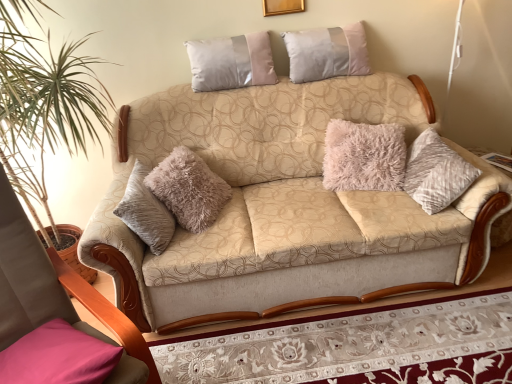
What is the approximate width of gold wooden picture frame at upper center?

gold wooden picture frame at upper center is 1.23 inches in width.

How much space does satin-like beige pillow at upper center, placed as the second pillow when sorted from front to back, occupy horizontally?

The width of satin-like beige pillow at upper center, placed as the second pillow when sorted from front to back, is 18.73 centimeters.

This screenshot has width=512, height=384. Describe the element at coordinates (56, 294) in the screenshot. I see `wooden armchair at left` at that location.

Identify the location of gold wooden picture frame at upper center. The width and height of the screenshot is (512, 384). (282, 7).

You are a GUI agent. You are given a task and a screenshot of the screen. Output one action in this format:
    pyautogui.click(x=<x>, y=<y>)
    Task: Click on the rocking chair below the gold wooden picture frame at upper center (from a real-world perspective)
    This screenshot has height=384, width=512.
    Given the screenshot: What is the action you would take?
    pyautogui.click(x=56, y=294)

Which object is positioned more to the right, wooden armchair at left or gold wooden picture frame at upper center?

gold wooden picture frame at upper center.

Considering the sizes of objects wooden armchair at left and gold wooden picture frame at upper center in the image provided, who is shorter, wooden armchair at left or gold wooden picture frame at upper center?

gold wooden picture frame at upper center.

Is wooden armchair at left thinner than gold wooden picture frame at upper center?

No, wooden armchair at left is not thinner than gold wooden picture frame at upper center.

Based on the photo, from the image's perspective, does pink fabric pillow at lower left, the 1th pillow viewed from the front, appear higher than silky silver pillow at upper center, the third pillow in the bottom-to-top sequence?

No.

From a real-world perspective, which object stands above the other?

silky silver pillow at upper center, the third pillow in the bottom-to-top sequence, from a real-world perspective.

Considering the relative sizes of pink fabric pillow at lower left, the 1th pillow viewed from the front, and silky silver pillow at upper center, which is the third pillow from left to right, in the image provided, is pink fabric pillow at lower left, the 1th pillow viewed from the front, taller than silky silver pillow at upper center, which is the third pillow from left to right,?

No.

Can you confirm if pink fabric pillow at lower left, marked as the first pillow in a left-to-right arrangement, is taller than gold wooden picture frame at upper center?

Incorrect, the height of pink fabric pillow at lower left, marked as the first pillow in a left-to-right arrangement, is not larger of that of gold wooden picture frame at upper center.

The height and width of the screenshot is (384, 512). Find the location of `picture frame behind the pink fabric pillow at lower left, which appears as the third pillow when viewed from the right`. picture frame behind the pink fabric pillow at lower left, which appears as the third pillow when viewed from the right is located at coordinates (282, 7).

Does pink fabric pillow at lower left, which appears as the third pillow when viewed from the right, turn towards gold wooden picture frame at upper center?

No, pink fabric pillow at lower left, which appears as the third pillow when viewed from the right, is not turned towards gold wooden picture frame at upper center.

Would you say pink fabric pillow at lower left, which appears as the third pillow when viewed from the right, is outside gold wooden picture frame at upper center?

pink fabric pillow at lower left, which appears as the third pillow when viewed from the right, is positioned outside gold wooden picture frame at upper center.

Looking at this image, can you confirm if pink fabric pillow at lower left, which ranks as the 3th pillow in top-to-bottom order, is taller than wooden armchair at left?

No, pink fabric pillow at lower left, which ranks as the 3th pillow in top-to-bottom order, is not taller than wooden armchair at left.

Is pink fabric pillow at lower left, which appears as the third pillow when viewed from the right, far from wooden armchair at left?

No, pink fabric pillow at lower left, which appears as the third pillow when viewed from the right, is not far away from wooden armchair at left.

Consider the image. From the image's perspective, which is above, pink fabric pillow at lower left, which ranks as the 3th pillow in top-to-bottom order, or wooden armchair at left?

wooden armchair at left appears higher in the image.

From the picture: From the image's perspective, is satin-like beige pillow at upper center, which is the second pillow in bottom-to-top order, positioned above or below silky silver pillow at upper center, which is counted as the first pillow, starting from the back?

satin-like beige pillow at upper center, which is the second pillow in bottom-to-top order, is below silky silver pillow at upper center, which is counted as the first pillow, starting from the back.

Looking at this image, measure the distance between satin-like beige pillow at upper center, which is the second pillow in bottom-to-top order, and silky silver pillow at upper center, arranged as the 3th pillow when viewed from the front.

A distance of 12.44 inches exists between satin-like beige pillow at upper center, which is the second pillow in bottom-to-top order, and silky silver pillow at upper center, arranged as the 3th pillow when viewed from the front.

Which pillow is the 1st one when counting from the left side of the silky silver pillow at upper center, which is the third pillow from left to right? Please provide its 2D coordinates.

[(231, 62)]

Between satin-like beige pillow at upper center, the second pillow positioned from the back, and silky silver pillow at upper center, the 1th pillow viewed from the top, which one has larger width?

silky silver pillow at upper center, the 1th pillow viewed from the top.

From the image's perspective, is gold wooden picture frame at upper center above satin-like beige pillow at upper center, marked as the 2th pillow in a right-to-left arrangement?

Correct, gold wooden picture frame at upper center appears higher than satin-like beige pillow at upper center, marked as the 2th pillow in a right-to-left arrangement, in the image.

From a real-world perspective, is gold wooden picture frame at upper center over satin-like beige pillow at upper center, which is counted as the 2th pillow, starting from the top?

Yes, from a real-world perspective, gold wooden picture frame at upper center is on top of satin-like beige pillow at upper center, which is counted as the 2th pillow, starting from the top.

Does gold wooden picture frame at upper center have a larger size compared to satin-like beige pillow at upper center, placed as the second pillow when sorted from front to back?

Incorrect, gold wooden picture frame at upper center is not larger than satin-like beige pillow at upper center, placed as the second pillow when sorted from front to back.

What's the angular difference between gold wooden picture frame at upper center and satin-like beige pillow at upper center, the second pillow viewed from the left,'s facing directions?

The angular difference between gold wooden picture frame at upper center and satin-like beige pillow at upper center, the second pillow viewed from the left, is 2.12 degrees.

Considering the relative sizes of silky silver pillow at upper center, which is the third pillow from left to right, and beige fabric couch at center in the image provided, is silky silver pillow at upper center, which is the third pillow from left to right, smaller than beige fabric couch at center?

Yes, silky silver pillow at upper center, which is the third pillow from left to right, is smaller than beige fabric couch at center.

The width and height of the screenshot is (512, 384). I want to click on studio couch below the silky silver pillow at upper center, the third pillow in the bottom-to-top sequence (from the image's perspective), so click(285, 207).

Which of these two, silky silver pillow at upper center, which is the third pillow from left to right, or beige fabric couch at center, is wider?

beige fabric couch at center.

Consider the image. Do you think silky silver pillow at upper center, which is counted as the first pillow, starting from the back, is within beige fabric couch at center, or outside of it?

silky silver pillow at upper center, which is counted as the first pillow, starting from the back, is spatially situated outside beige fabric couch at center.

I want to click on picture frame that is above the wooden armchair at left (from the image's perspective), so click(x=282, y=7).

Which pillow is the 2nd one when counting from the right side of the pink fabric pillow at lower left, marked as the first pillow in a left-to-right arrangement? Please provide its 2D coordinates.

[(327, 53)]

Based on their spatial positions, is wooden armchair at left or beige fabric couch at center further from gold wooden picture frame at upper center?

The object further to gold wooden picture frame at upper center is wooden armchair at left.

When comparing their distances from pink fabric pillow at lower left, the 1th pillow viewed from the front, does beige fabric couch at center or satin-like beige pillow at upper center, which is the second pillow in bottom-to-top order, seem closer?

The object closer to pink fabric pillow at lower left, the 1th pillow viewed from the front, is beige fabric couch at center.

When comparing their distances from silky silver pillow at upper center, which is counted as the first pillow, starting from the back, does beige fabric couch at center or gold wooden picture frame at upper center seem further?

beige fabric couch at center is further to silky silver pillow at upper center, which is counted as the first pillow, starting from the back.

In the scene shown: Considering their positions, is satin-like beige pillow at upper center, the second pillow positioned from the back, positioned closer to beige fabric couch at center than silky silver pillow at upper center, the 1th pillow positioned from the right?

satin-like beige pillow at upper center, the second pillow positioned from the back, lies closer to beige fabric couch at center than the other object.

Estimate the real-world distances between objects in this image. Which object is further from satin-like beige pillow at upper center, the second pillow positioned from the back, beige fabric couch at center or pink fabric pillow at lower left, arranged as the 1th pillow when ordered from the bottom?

pink fabric pillow at lower left, arranged as the 1th pillow when ordered from the bottom.

When comparing their distances from pink fabric pillow at lower left, the 1th pillow viewed from the front, does silky silver pillow at upper center, which is counted as the first pillow, starting from the back, or wooden armchair at left seem closer?

wooden armchair at left.

Considering their positions, is pink fabric pillow at lower left, arranged as the 1th pillow when ordered from the bottom, positioned closer to satin-like beige pillow at upper center, which is the second pillow in bottom-to-top order, than silky silver pillow at upper center, the 1th pillow positioned from the right?

silky silver pillow at upper center, the 1th pillow positioned from the right.

Which object lies nearer to the anchor point wooden armchair at left, pink fabric pillow at lower left, marked as the first pillow in a left-to-right arrangement, or gold wooden picture frame at upper center?

The object closer to wooden armchair at left is pink fabric pillow at lower left, marked as the first pillow in a left-to-right arrangement.

Where is `rocking chair that lies between silky silver pillow at upper center, the 1th pillow viewed from the top, and pink fabric pillow at lower left, the 1th pillow viewed from the front, from top to bottom`? This screenshot has width=512, height=384. rocking chair that lies between silky silver pillow at upper center, the 1th pillow viewed from the top, and pink fabric pillow at lower left, the 1th pillow viewed from the front, from top to bottom is located at coordinates (56, 294).

Locate an element on the screen. The image size is (512, 384). pillow between wooden armchair at left and satin-like beige pillow at upper center, which is the second pillow in bottom-to-top order, from front to back is located at coordinates (58, 357).

Identify the location of studio couch between satin-like beige pillow at upper center, the second pillow viewed from the left, and pink fabric pillow at lower left, which is the 3th pillow from back to front, in the up-down direction. (285, 207).

Image resolution: width=512 pixels, height=384 pixels. What are the coordinates of `studio couch that lies between silky silver pillow at upper center, which is the third pillow from left to right, and pink fabric pillow at lower left, which appears as the third pillow when viewed from the right, from top to bottom` in the screenshot? It's located at (285, 207).